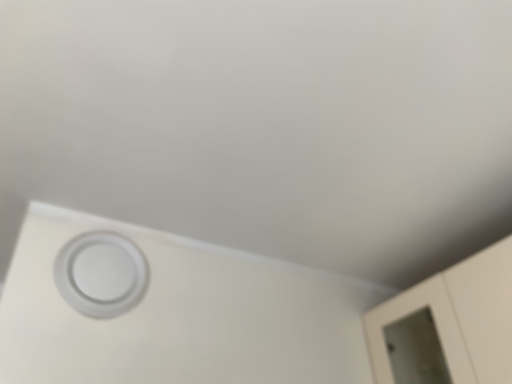
I want to click on white matte circle at lower left, so (101, 274).

The height and width of the screenshot is (384, 512). What do you see at coordinates (101, 274) in the screenshot? I see `white matte circle at lower left` at bounding box center [101, 274].

Where is `white matte circle at lower left`? The height and width of the screenshot is (384, 512). white matte circle at lower left is located at coordinates (101, 274).